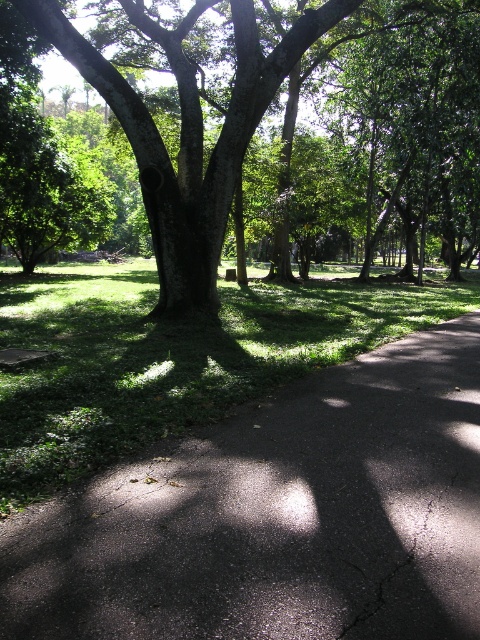
Question: Among these objects, which one is farthest from the camera?

Choices:
 (A) black asphalt pavement at center
 (B) green rough bark tree at center

Answer: (B)

Question: Is black asphalt pavement at center bigger than green rough bark tree at center?

Choices:
 (A) yes
 (B) no

Answer: (B)

Question: Is black asphalt pavement at center thinner than green rough bark tree at center?

Choices:
 (A) yes
 (B) no

Answer: (A)

Question: Which of the following is the farthest from the observer?

Choices:
 (A) black asphalt pavement at center
 (B) green rough bark tree at center

Answer: (B)

Question: Does black asphalt pavement at center appear under green rough bark tree at center?

Choices:
 (A) yes
 (B) no

Answer: (A)